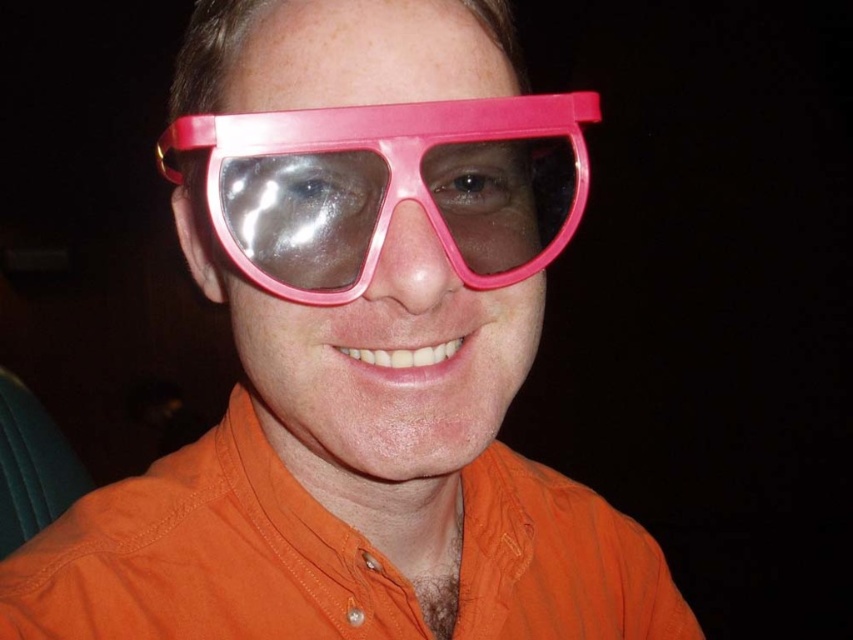
Can you confirm if orange cotton shirt at center is positioned to the left of pink plastic goggles at center?

No, orange cotton shirt at center is not to the left of pink plastic goggles at center.

Who is lower down, orange cotton shirt at center or pink plastic goggles at center?

orange cotton shirt at center is below.

Who is more forward, [223,621] or [577,202]?

Positioned in front is point [577,202].

At what (x,y) coordinates should I click in order to perform the action: click on orange cotton shirt at center. Please return your answer as a coordinate pair (x, y). The width and height of the screenshot is (853, 640). Looking at the image, I should click on (206, 556).